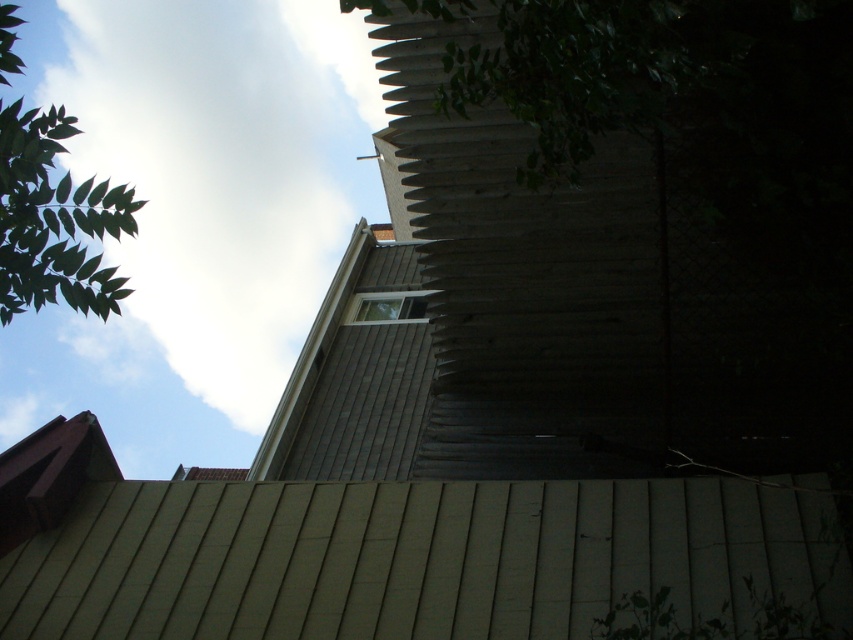
Is the position of green leafy tree at upper left more distant than that of clear glass window at upper center?

No.

Find the location of `green leafy tree at upper left`. green leafy tree at upper left is located at coordinates (53, 220).

Describe the element at coordinates (53, 220) in the screenshot. I see `green leafy tree at upper left` at that location.

Where is `green leafy tree at upper left`? green leafy tree at upper left is located at coordinates (53, 220).